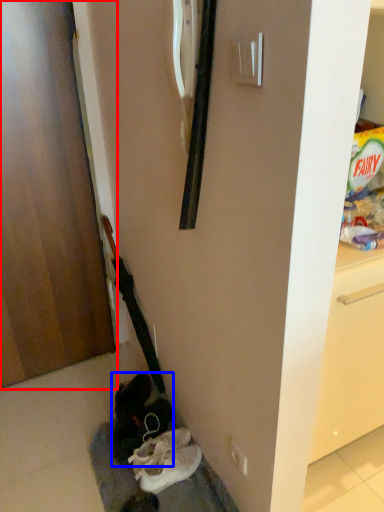
Question: Which point is closer to the camera, door (highlighted by a red box) or footwear (highlighted by a blue box)?

Choices:
 (A) door
 (B) footwear

Answer: (A)